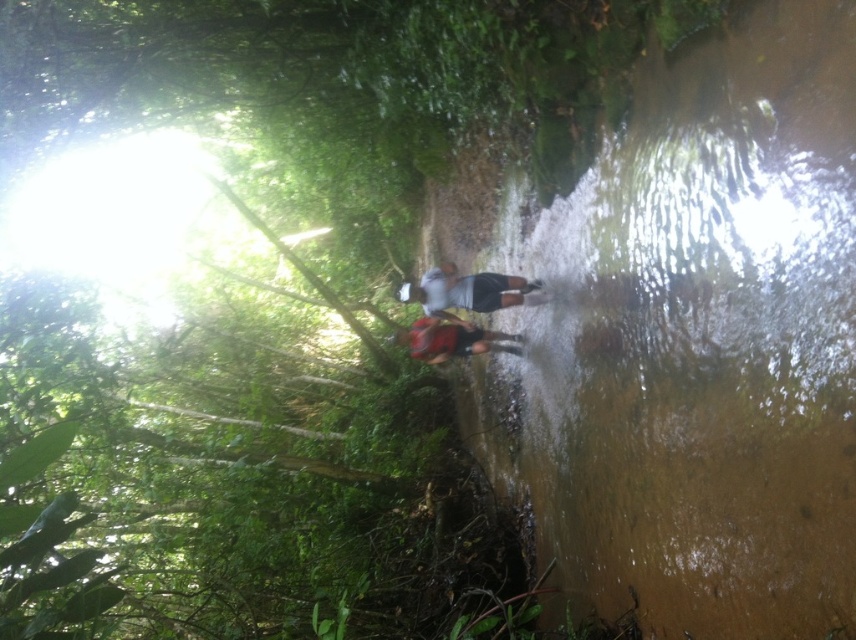
Question: Can you confirm if brown murky water at center is positioned above red fabric backpack at center?

Choices:
 (A) no
 (B) yes

Answer: (A)

Question: Can you confirm if brown murky water at center is bigger than gray matte shirt at center?

Choices:
 (A) yes
 (B) no

Answer: (A)

Question: Which object appears closest to the camera in this image?

Choices:
 (A) red fabric backpack at center
 (B) brown murky water at center
 (C) gray matte shirt at center

Answer: (B)

Question: Estimate the real-world distances between objects in this image. Which object is farther from the red fabric backpack at center?

Choices:
 (A) gray matte shirt at center
 (B) brown murky water at center

Answer: (B)

Question: Which point is farther to the camera?

Choices:
 (A) brown murky water at center
 (B) gray matte shirt at center

Answer: (B)

Question: Can you confirm if gray matte shirt at center is bigger than red fabric backpack at center?

Choices:
 (A) yes
 (B) no

Answer: (A)